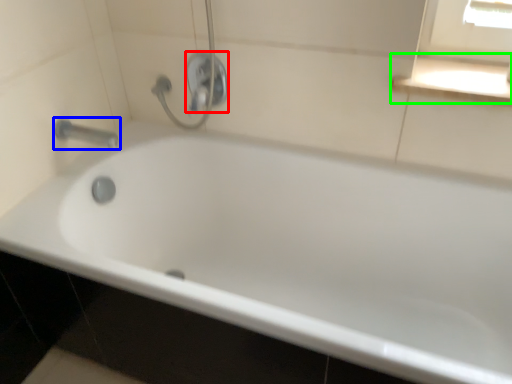
Question: Which object is the closest to the shower (highlighted by a red box)? Choose among these: tap (highlighted by a blue box) or window sill (highlighted by a green box).

Choices:
 (A) tap
 (B) window sill

Answer: (A)